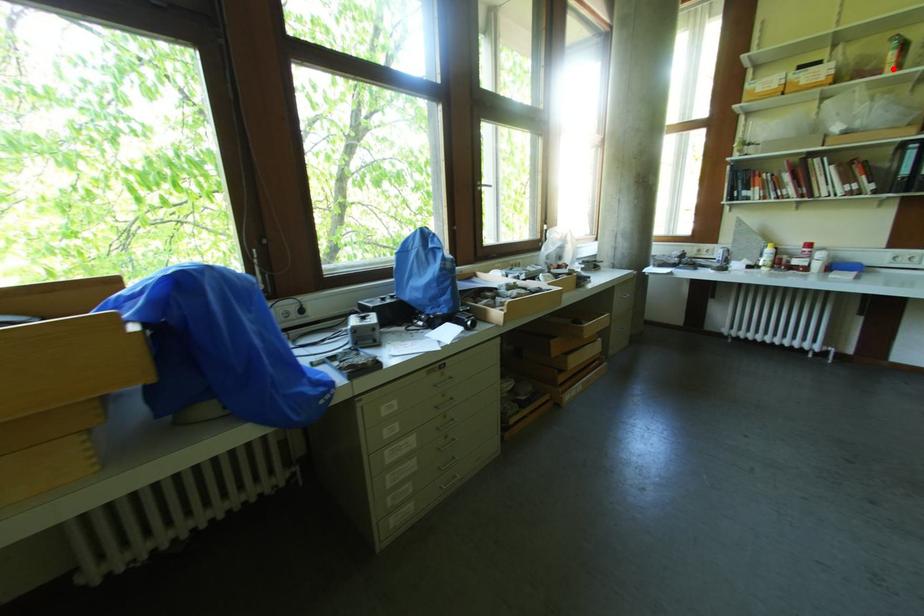
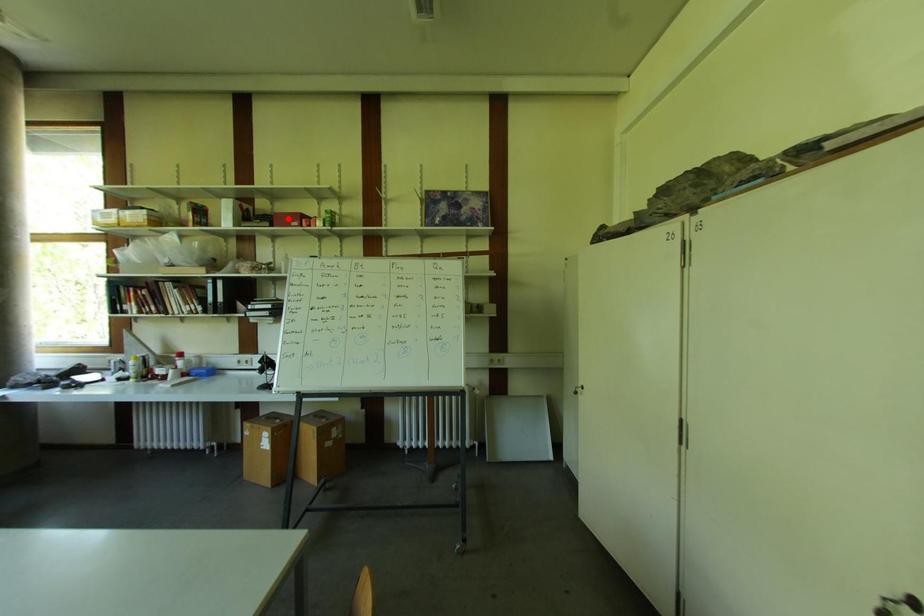
I am providing you with two images of the same scene from different viewpoints. A red point is marked on the first image and another point is marked on the second image. Do the highlighted points in image1 and image2 indicate the same real-world spot?

No